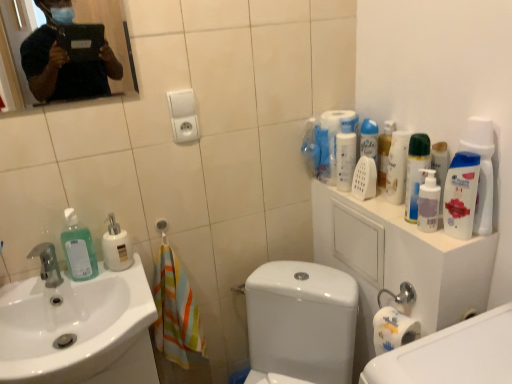
Image resolution: width=512 pixels, height=384 pixels. In order to click on vacant space positioned to the left of white glossy mouthwash at upper right, which is counted as the first mouthwash, starting from the front in this screenshot , I will do `click(419, 235)`.